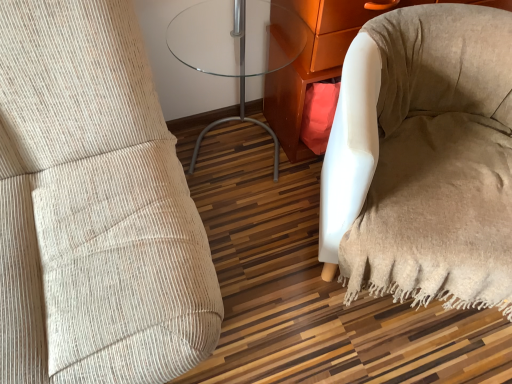
Question: From a real-world perspective, does beige fabric bean bag chair at lower right stand above white fabric armchair at lower right?

Choices:
 (A) yes
 (B) no

Answer: (B)

Question: Is beige fabric bean bag chair at lower right positioned behind white fabric armchair at lower right?

Choices:
 (A) no
 (B) yes

Answer: (A)

Question: From a real-world perspective, is beige fabric bean bag chair at lower right positioned under white fabric armchair at lower right based on gravity?

Choices:
 (A) yes
 (B) no

Answer: (A)

Question: Considering the relative sizes of beige fabric bean bag chair at lower right and white fabric armchair at lower right in the image provided, is beige fabric bean bag chair at lower right taller than white fabric armchair at lower right?

Choices:
 (A) yes
 (B) no

Answer: (B)

Question: Is beige fabric bean bag chair at lower right oriented towards white fabric armchair at lower right?

Choices:
 (A) no
 (B) yes

Answer: (A)

Question: Is beige fabric bean bag chair at lower right not within white fabric armchair at lower right?

Choices:
 (A) no
 (B) yes

Answer: (B)

Question: Is white fabric armchair at lower right thinner than transparent glass table at center?

Choices:
 (A) no
 (B) yes

Answer: (B)

Question: Is the depth of white fabric armchair at lower right greater than that of transparent glass table at center?

Choices:
 (A) no
 (B) yes

Answer: (B)

Question: From the image's perspective, is white fabric armchair at lower right above transparent glass table at center?

Choices:
 (A) no
 (B) yes

Answer: (B)

Question: Can you confirm if white fabric armchair at lower right is smaller than transparent glass table at center?

Choices:
 (A) no
 (B) yes

Answer: (A)

Question: Does white fabric armchair at lower right have a greater width compared to transparent glass table at center?

Choices:
 (A) no
 (B) yes

Answer: (A)

Question: Does white fabric armchair at lower right appear on the right side of transparent glass table at center?

Choices:
 (A) yes
 (B) no

Answer: (A)

Question: Are white fabric armchair at lower right and beige fabric bean bag chair at lower right making contact?

Choices:
 (A) no
 (B) yes

Answer: (A)